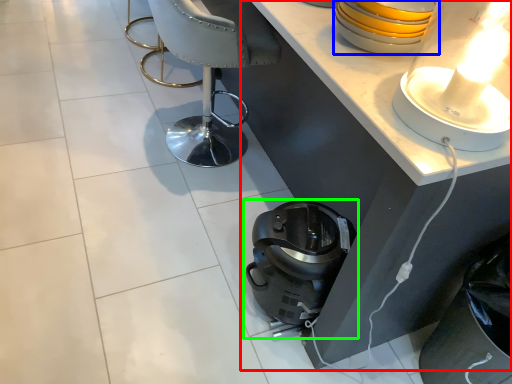
Question: Based on their relative distances, which object is farther from table (highlighted by a red box)? Choose from appliance (highlighted by a blue box) and home appliance (highlighted by a green box).

Choices:
 (A) appliance
 (B) home appliance

Answer: (B)